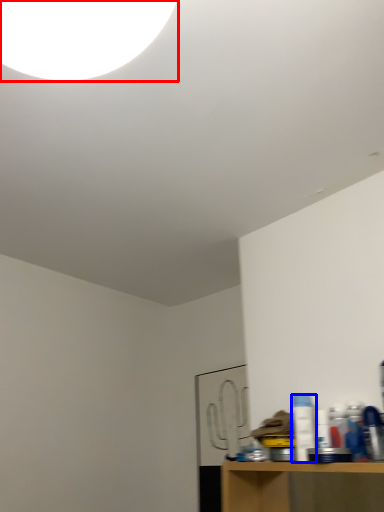
Question: Which object appears closest to the camera in this image, light (highlighted by a red box) or bottle (highlighted by a blue box)?

Choices:
 (A) light
 (B) bottle

Answer: (A)